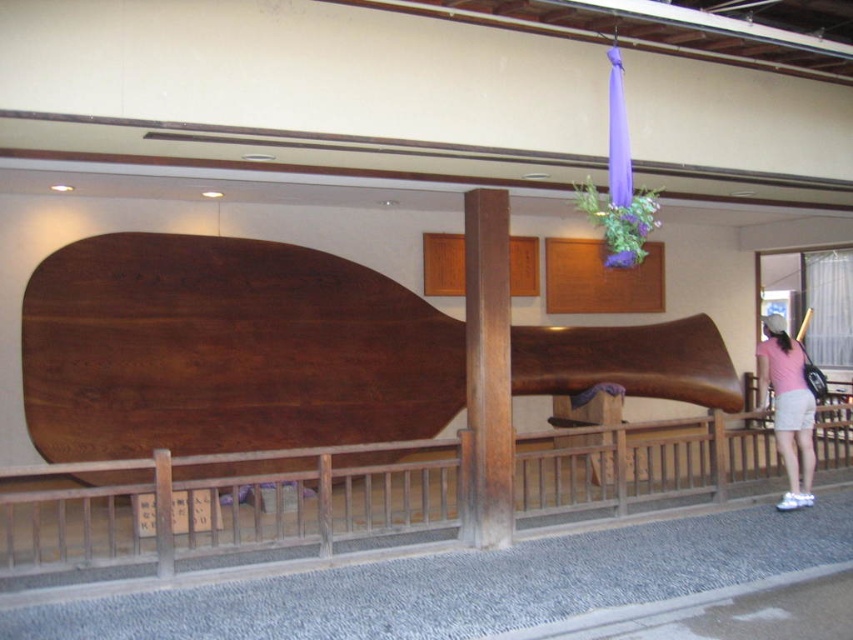
Question: Does brown polished wood at center appear under pink fabric at lower right?

Choices:
 (A) yes
 (B) no

Answer: (B)

Question: Estimate the real-world distances between objects in this image. Which object is closer to the pink fabric at lower right?

Choices:
 (A) wooden at lower center
 (B) shiny brown wooden boat at center
 (C) brown polished wood at center

Answer: (A)

Question: Estimate the real-world distances between objects in this image. Which object is farther from the shiny brown wooden boat at center?

Choices:
 (A) brown polished wood at center
 (B) pink fabric at lower right

Answer: (B)

Question: Does shiny brown wooden boat at center have a smaller size compared to brown polished wood at center?

Choices:
 (A) no
 (B) yes

Answer: (A)

Question: Which object is farther from the camera taking this photo?

Choices:
 (A) brown polished wood at center
 (B) shiny brown wooden boat at center
 (C) pink fabric at lower right

Answer: (C)

Question: Can you confirm if shiny brown wooden boat at center is positioned below pink fabric at lower right?

Choices:
 (A) no
 (B) yes

Answer: (A)